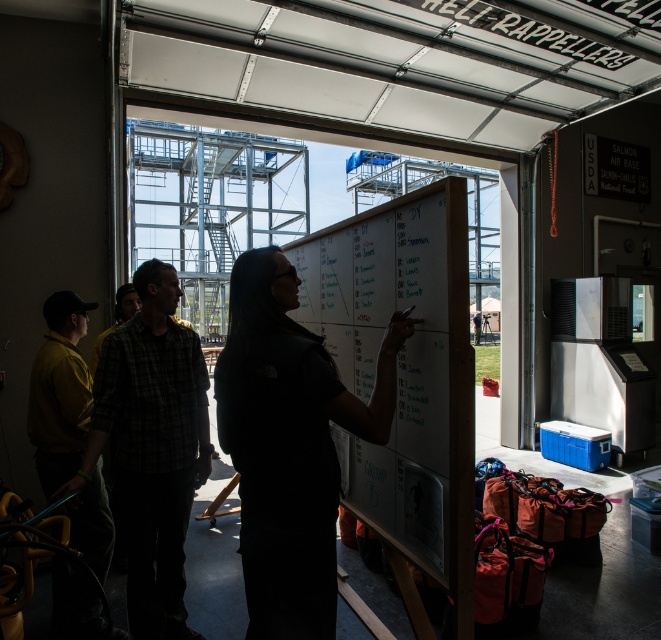
Question: Can you confirm if yellow matte shirt at left is positioned to the left of plaid shirt at center?

Choices:
 (A) yes
 (B) no

Answer: (B)

Question: Which of the following is the farthest from the observer?

Choices:
 (A) (98, 333)
 (B) (451, 408)
 (C) (235, 467)

Answer: (A)

Question: Which object is the closest to the whiteboard at center?

Choices:
 (A) plaid fabric shirt at center
 (B) yellow matte shirt at left

Answer: (A)

Question: Estimate the real-world distances between objects in this image. Which object is closer to the plaid fabric shirt at center?

Choices:
 (A) plaid shirt at center
 (B) yellow matte shirt at left
 (C) black matte shirt at center
 (D) whiteboard at center

Answer: (B)

Question: Where is whiteboard at center located in relation to yellow matte shirt at left in the image?

Choices:
 (A) below
 (B) above

Answer: (B)

Question: Does black matte shirt at center appear on the right side of plaid shirt at center?

Choices:
 (A) no
 (B) yes

Answer: (B)